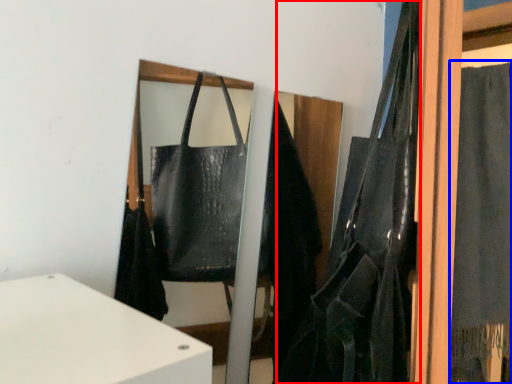
Question: Among these objects, which one is farthest to the camera, shoulder bag (highlighted by a red box) or curtain (highlighted by a blue box)?

Choices:
 (A) shoulder bag
 (B) curtain

Answer: (B)